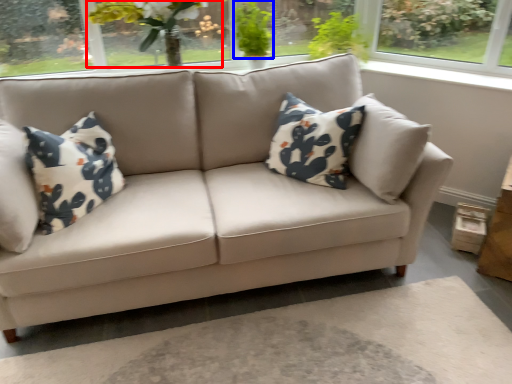
Question: Which of the following is the farthest to the observer, floral arrangement (highlighted by a red box) or plant (highlighted by a blue box)?

Choices:
 (A) floral arrangement
 (B) plant

Answer: (B)